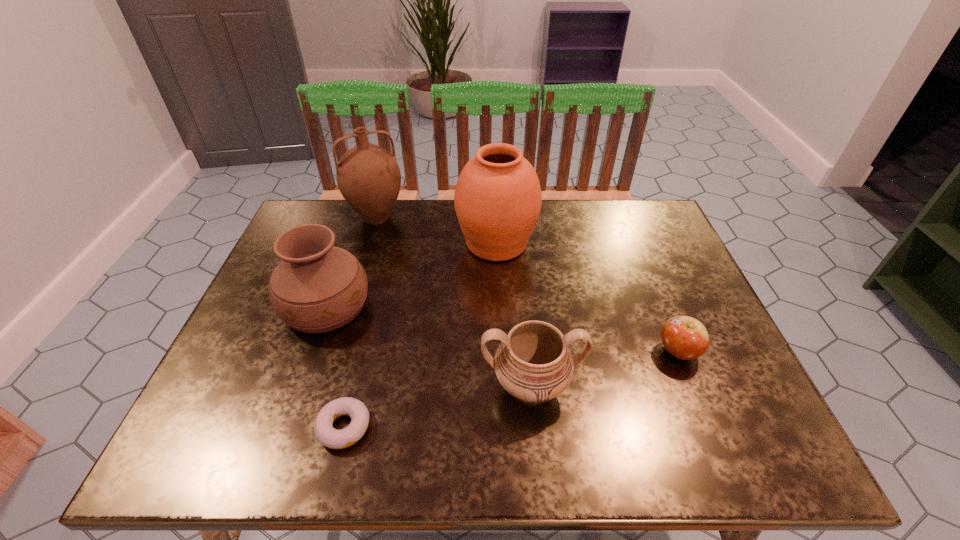
Where is `object present at the right edge`? The image size is (960, 540). object present at the right edge is located at coordinates (684, 337).

At what (x,y) coordinates should I click in order to perform the action: click on object situated at the far left corner. Please return your answer as a coordinate pair (x, y). The image size is (960, 540). Looking at the image, I should click on (368, 176).

Where is `vacant space at the far edge`? vacant space at the far edge is located at coordinates click(x=434, y=205).

Locate an element on the screen. The width and height of the screenshot is (960, 540). vacant region at the near edge of the desktop is located at coordinates (572, 453).

The width and height of the screenshot is (960, 540). In the image, there is a desktop. Find the location of `free space at the right edge`. free space at the right edge is located at coordinates (639, 276).

Find the location of a particular element. This screenshot has width=960, height=540. vacant space at the far left corner of the desktop is located at coordinates (303, 218).

In the image, there is a desktop. At what (x,y) coordinates should I click in order to perform the action: click on vacant space at the far right corner. Please return your answer as a coordinate pair (x, y). This screenshot has height=540, width=960. Looking at the image, I should click on (634, 227).

I want to click on empty space that is in between the third tallest object and the farthest urn, so click(411, 275).

You are a GUI agent. You are given a task and a screenshot of the screen. Output one action in this format:
    pyautogui.click(x=<x>, y=<y>)
    Task: Click on the vacant space that is in between the shortest object and the nearest urn
    Image resolution: width=960 pixels, height=540 pixels.
    Given the screenshot: What is the action you would take?
    (437, 406)

Locate an element on the screen. The image size is (960, 540). free spot between the tallest urn and the pitcher is located at coordinates (437, 231).